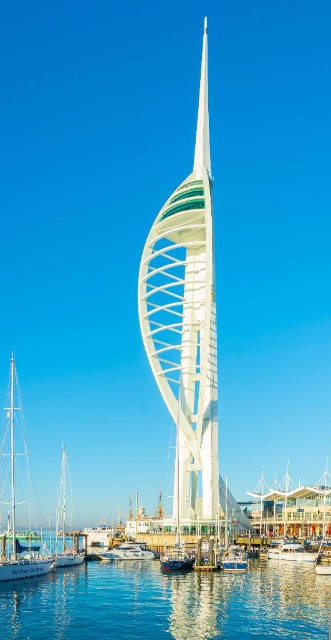
Question: Which of these objects is positioned closest to the white sailboat at left?

Choices:
 (A) white glossy boat at center
 (B) blue glossy sailboat at center
 (C) blue liquid water at lower center
 (D) blue metallic boat at center

Answer: (A)

Question: Which is nearer to the blue metallic boat at center?

Choices:
 (A) white sailboat at left
 (B) white glossy sailboat at center

Answer: (B)

Question: Can you confirm if white sailboat at left is thinner than blue metallic boat at center?

Choices:
 (A) no
 (B) yes

Answer: (A)

Question: Which object appears farthest from the camera in this image?

Choices:
 (A) blue glossy sailboat at center
 (B) blue liquid water at lower center

Answer: (A)

Question: Where is blue liquid water at lower center located in relation to white sailboat at lower left in the image?

Choices:
 (A) left
 (B) right

Answer: (B)

Question: Can you confirm if white glossy sailboat at center is positioned below blue metallic boat at center?

Choices:
 (A) no
 (B) yes

Answer: (B)